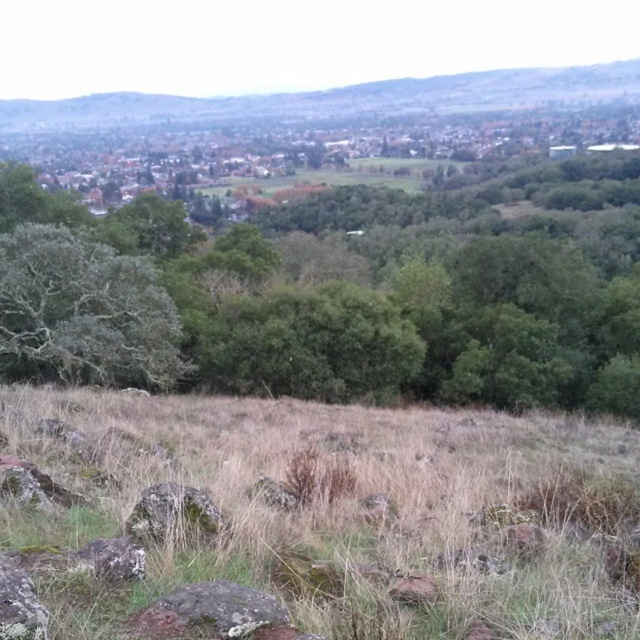
Question: Based on their relative distances, which object is nearer to the gray rough rock at lower left?

Choices:
 (A) green mossy rock at center
 (B) mossy rock at lower left
 (C) green leafy tree at center

Answer: (A)

Question: Can you confirm if green mossy rock at center is positioned to the left of gray rough rock at lower left?

Choices:
 (A) no
 (B) yes

Answer: (A)

Question: Does dry grass at center appear over green grassy hillside at upper center?

Choices:
 (A) no
 (B) yes

Answer: (A)

Question: Is mossy rock at lower center above green mossy rock at lower left?

Choices:
 (A) yes
 (B) no

Answer: (B)

Question: Which of the following is the closest to the observer?

Choices:
 (A) (193, 524)
 (B) (113, 560)
 (C) (253, 598)
 (D) (317, 358)

Answer: (C)

Question: Which object is the closest to the green mossy rock at lower left?

Choices:
 (A) green leafy tree at center
 (B) green grassy hillside at upper center
 (C) mossy rock at lower center

Answer: (C)